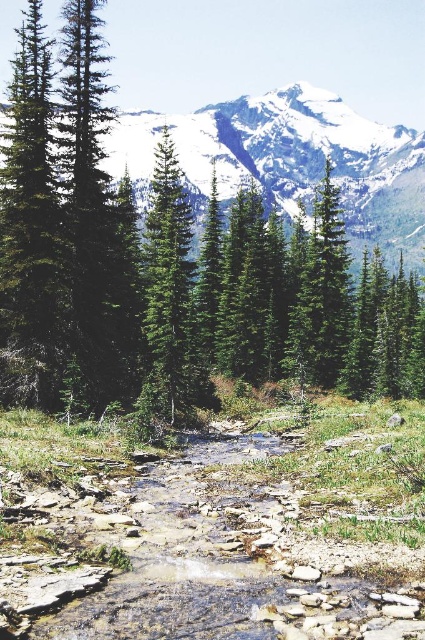
Which is above, green matte tree at center or rocky gravel stream at center?

green matte tree at center is above.

Is point (130, 262) farther from viewer compared to point (201, 436)?

Yes, point (130, 262) is farther from viewer.

This screenshot has height=640, width=425. In order to click on green matte tree at center in this screenshot , I will do `click(189, 236)`.

Between green matte tree at center and snowy granite mountain at upper center, which one appears on the right side from the viewer's perspective?

From the viewer's perspective, snowy granite mountain at upper center appears more on the right side.

What do you see at coordinates (189, 236) in the screenshot? The image size is (425, 640). I see `green matte tree at center` at bounding box center [189, 236].

This screenshot has width=425, height=640. I want to click on green matte tree at center, so click(189, 236).

Based on the photo, does rocky gravel stream at center come behind snowy granite mountain at upper center?

No, rocky gravel stream at center is in front of snowy granite mountain at upper center.

Can you confirm if rocky gravel stream at center is positioned below snowy granite mountain at upper center?

Yes, rocky gravel stream at center is below snowy granite mountain at upper center.

Does point (388, 490) come farther from viewer compared to point (295, 129)?

No.

I want to click on rocky gravel stream at center, so click(x=217, y=532).